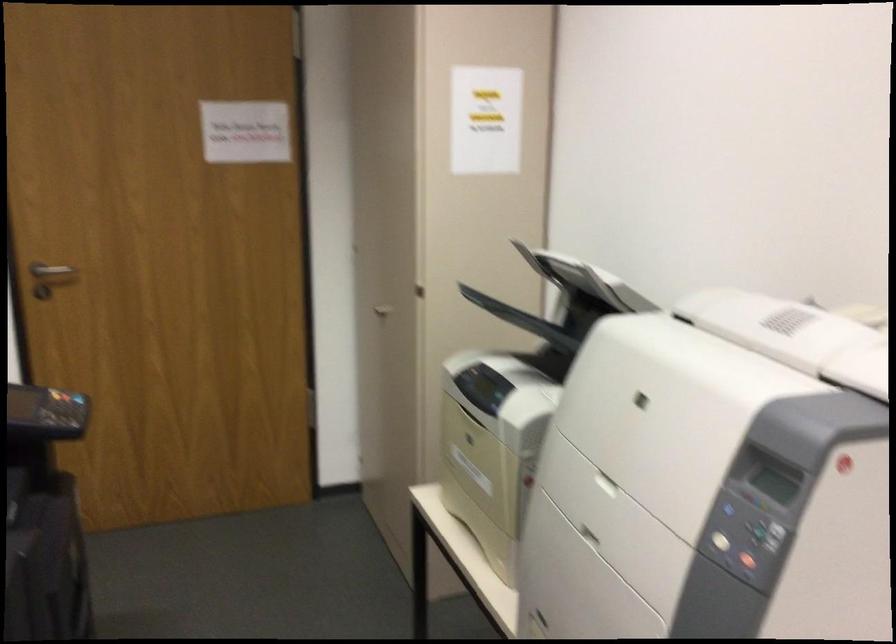
The image size is (896, 644). Describe the element at coordinates (495, 410) in the screenshot. I see `a printer paper tray` at that location.